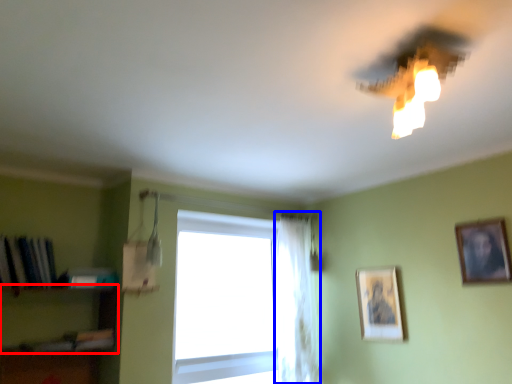
Question: Among these objects, which one is farthest to the camera, shelf (highlighted by a red box) or curtain (highlighted by a blue box)?

Choices:
 (A) shelf
 (B) curtain

Answer: (B)